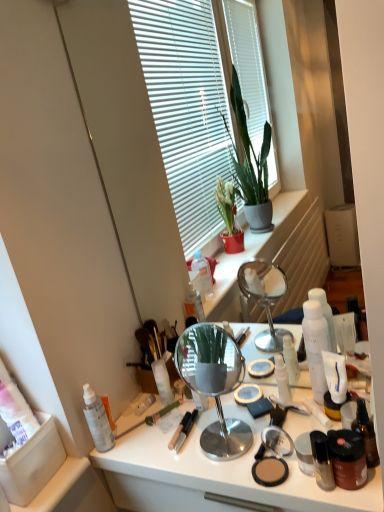
Locate an element on the screen. This screenshot has height=512, width=384. free space that is in between matte brown compact at lower center and green plastic paint brush at lower left is located at coordinates (188, 448).